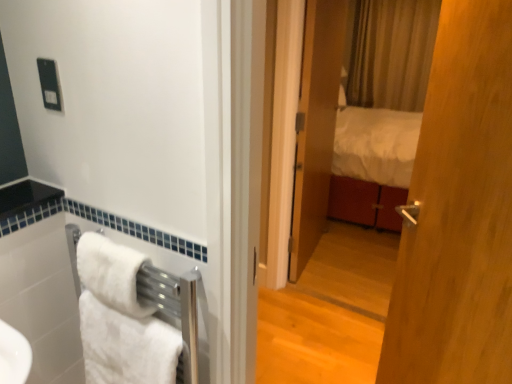
Question: From a real-world perspective, is white soft towel at lower left, which is the 2th towel/napkin in bottom-to-top order, located beneath black plastic outlet at upper left?

Choices:
 (A) no
 (B) yes

Answer: (B)

Question: Considering the relative sizes of white soft towel at lower left, which is the 1th towel/napkin in top-to-bottom order, and black plastic outlet at upper left in the image provided, is white soft towel at lower left, which is the 1th towel/napkin in top-to-bottom order, wider than black plastic outlet at upper left?

Choices:
 (A) no
 (B) yes

Answer: (B)

Question: Could black plastic outlet at upper left be considered to be inside white soft towel at lower left, which is the 2th towel/napkin in bottom-to-top order?

Choices:
 (A) yes
 (B) no

Answer: (B)

Question: Is white soft towel at lower left, which is the 1th towel/napkin in top-to-bottom order, positioned beyond the bounds of black plastic outlet at upper left?

Choices:
 (A) no
 (B) yes

Answer: (B)

Question: Can you confirm if white soft towel at lower left, which is the 2th towel/napkin in bottom-to-top order, is taller than black plastic outlet at upper left?

Choices:
 (A) no
 (B) yes

Answer: (B)

Question: From a real-world perspective, is wooden door at center positioned above or below matte wooden mirror at center?

Choices:
 (A) above
 (B) below

Answer: (A)

Question: Considering the relative positions of wooden door at center and matte wooden mirror at center in the image provided, is wooden door at center to the left or to the right of matte wooden mirror at center?

Choices:
 (A) left
 (B) right

Answer: (A)

Question: In terms of size, does wooden door at center appear bigger or smaller than matte wooden mirror at center?

Choices:
 (A) big
 (B) small

Answer: (A)

Question: Is wooden door at center taller or shorter than matte wooden mirror at center?

Choices:
 (A) tall
 (B) short

Answer: (A)

Question: Considering the positions of point (105, 314) and point (84, 261), is point (105, 314) closer or farther from the camera than point (84, 261)?

Choices:
 (A) closer
 (B) farther

Answer: (B)

Question: In terms of width, does white fluffy towel at lower left, which is counted as the 1th towel/napkin, starting from the bottom, look wider or thinner when compared to white soft towel at lower left, which is the 1th towel/napkin in top-to-bottom order?

Choices:
 (A) thin
 (B) wide

Answer: (B)

Question: Is white fluffy towel at lower left, which is counted as the 1th towel/napkin, starting from the bottom, inside or outside of white soft towel at lower left, which is the 1th towel/napkin in top-to-bottom order?

Choices:
 (A) outside
 (B) inside

Answer: (A)

Question: In terms of size, does white fluffy towel at lower left, the 2th towel/napkin viewed from the top, appear bigger or smaller than white soft towel at lower left, which is the 1th towel/napkin in top-to-bottom order?

Choices:
 (A) big
 (B) small

Answer: (A)

Question: Does point (154, 377) appear closer or farther from the camera than point (53, 102)?

Choices:
 (A) farther
 (B) closer

Answer: (B)

Question: From a real-world perspective, relative to black plastic outlet at upper left, is white fluffy towel at lower left, which is counted as the 1th towel/napkin, starting from the bottom, vertically above or below?

Choices:
 (A) below
 (B) above

Answer: (A)